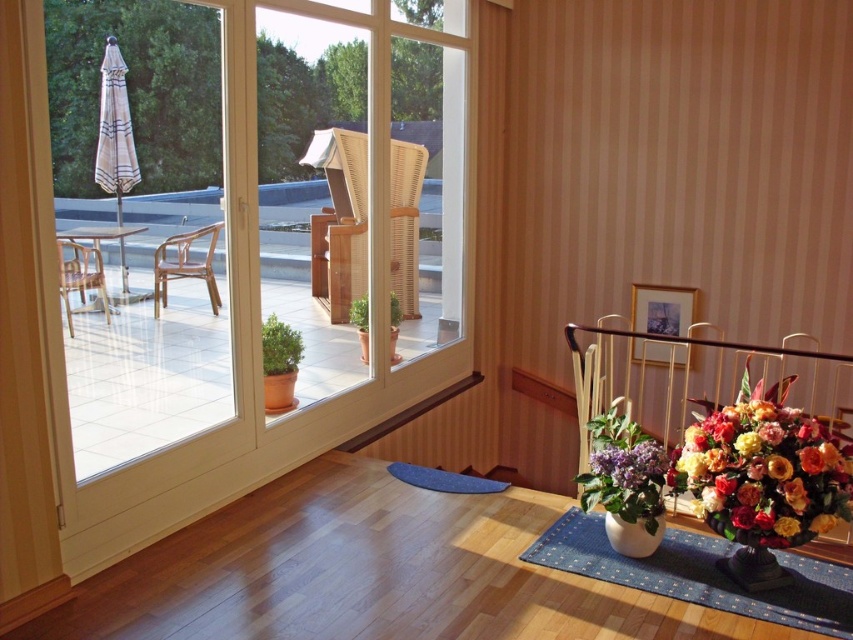
Is matte ceramic vase at lower right bigger than vibrant floral bouquet at lower right?

Indeed, matte ceramic vase at lower right has a larger size compared to vibrant floral bouquet at lower right.

Does matte ceramic vase at lower right have a lesser height compared to vibrant floral bouquet at lower right?

In fact, matte ceramic vase at lower right may be taller than vibrant floral bouquet at lower right.

Is point (763, 394) farther from camera compared to point (743, 440)?

Yes, point (763, 394) is farther from viewer.

Find the location of a particular element. Image resolution: width=853 pixels, height=640 pixels. matte ceramic vase at lower right is located at coordinates click(762, 477).

Between point (227, 390) and point (154, 296), which one is positioned behind?

The point (227, 390) is more distant.

Which is more to the left, transparent glass door at center or wooden chair at left?

wooden chair at left is more to the left.

This screenshot has width=853, height=640. What are the coordinates of `transparent glass door at center` in the screenshot? It's located at (241, 240).

Does vibrant floral bouquet at lower right appear on the right side of wooden chair at left?

Indeed, vibrant floral bouquet at lower right is positioned on the right side of wooden chair at left.

Locate an element on the screen. This screenshot has height=640, width=853. vibrant floral bouquet at lower right is located at coordinates (763, 470).

You are a GUI agent. You are given a task and a screenshot of the screen. Output one action in this format:
    pyautogui.click(x=<x>, y=<y>)
    Task: Click on the vibrant floral bouquet at lower right
    The height and width of the screenshot is (640, 853).
    Given the screenshot: What is the action you would take?
    pyautogui.click(x=763, y=470)